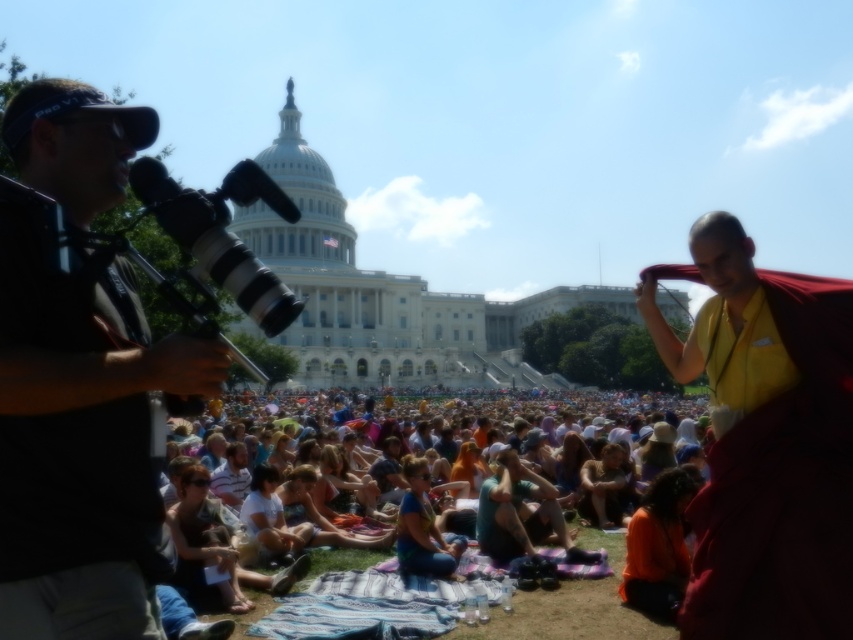
Question: Which object is closer to the camera taking this photo?

Choices:
 (A) black fabric camera at left
 (B) maroon silk robe at center

Answer: (A)

Question: Where is black fabric camera at left located in relation to maroon silk robe at center in the image?

Choices:
 (A) below
 (B) above

Answer: (B)

Question: Does black fabric camera at left have a greater width compared to multicolored fabric at center?

Choices:
 (A) no
 (B) yes

Answer: (A)

Question: Estimate the real-world distances between objects in this image. Which object is farther from the maroon silk robe at center?

Choices:
 (A) black fabric camera at left
 (B) multicolored fabric at center

Answer: (A)

Question: Estimate the real-world distances between objects in this image. Which object is closer to the multicolored fabric at center?

Choices:
 (A) maroon silk robe at center
 (B) black fabric camera at left

Answer: (A)

Question: Is maroon silk robe at center thinner than multicolored fabric at center?

Choices:
 (A) no
 (B) yes

Answer: (B)